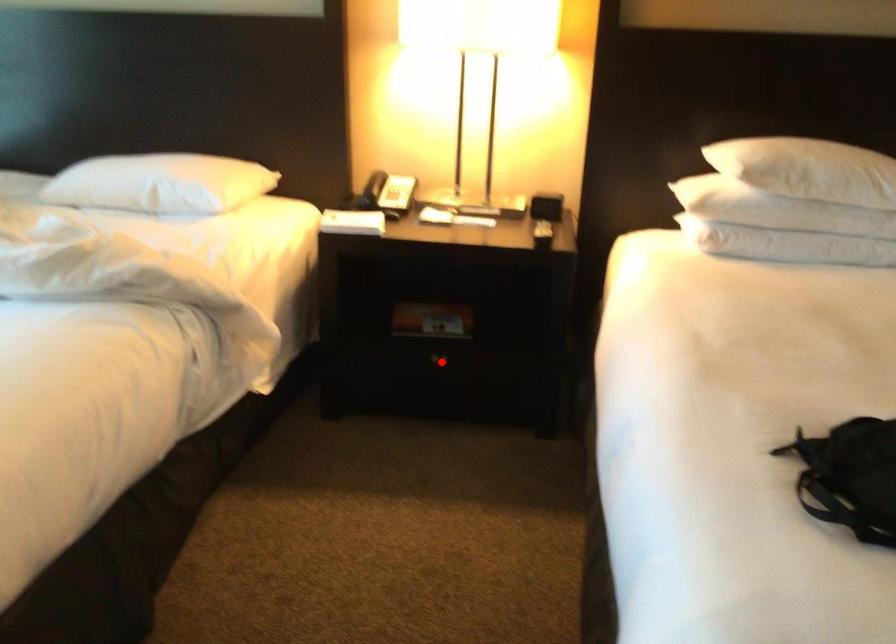
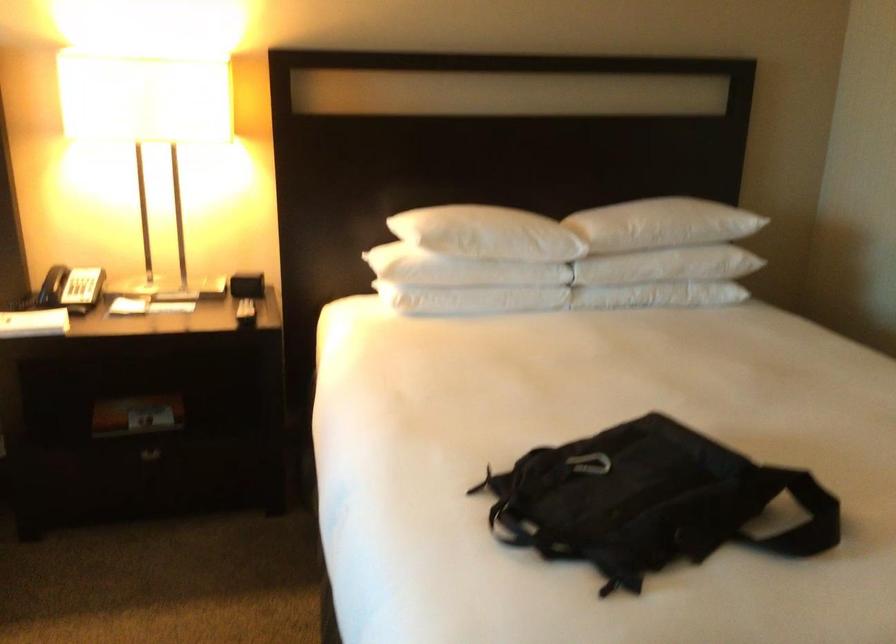
Where in the second image is the point corresponding to the highlighted location from the first image?

(151, 456)